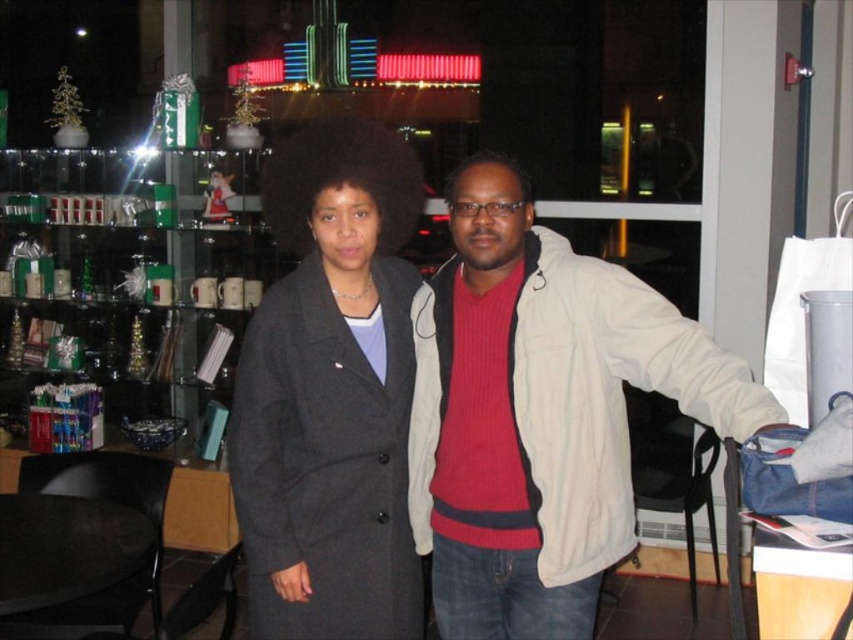
You are a shop assistant who needs to hang the matte beige jacket at center and the matte gray coat at center on the rack. Since the rack has limited vertical space, which one should you place higher up to ensure both fit?

The matte beige jacket at center is positioned under the matte gray coat at center in the image, so to fit both on the rack with limited vertical space, you should place the matte gray coat at center higher up above the matte beige jacket at center.